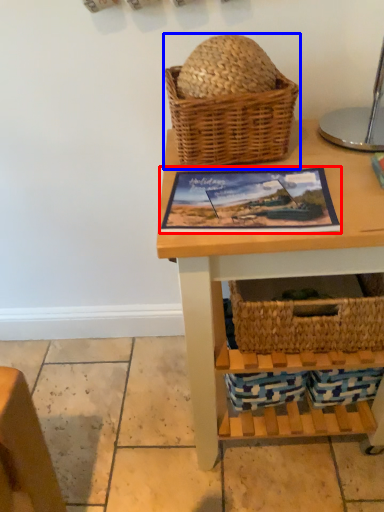
Question: Which object appears farthest to the camera in this image, picture frame (highlighted by a red box) or picnic basket (highlighted by a blue box)?

Choices:
 (A) picture frame
 (B) picnic basket

Answer: (B)